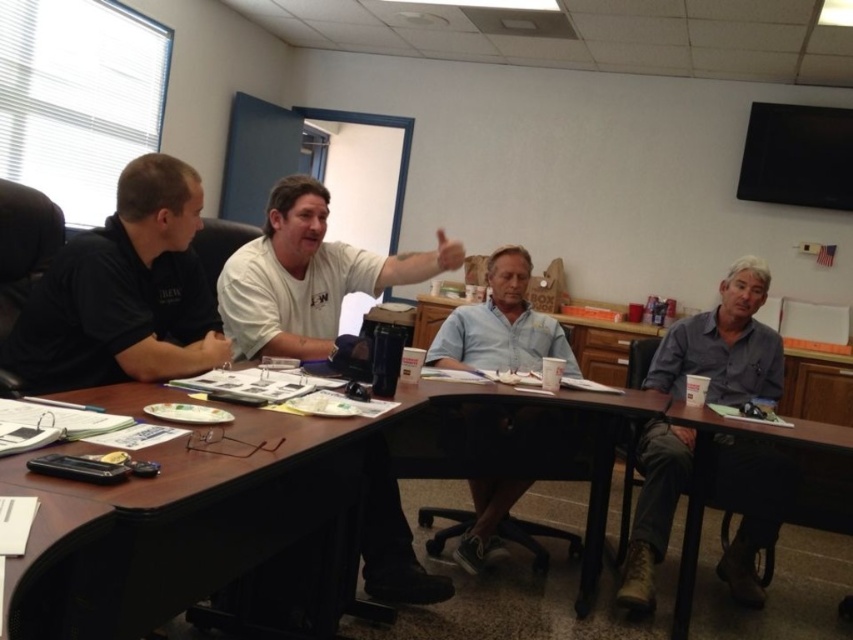
You are a photographer setting up for a group photo of the men seated around the conference table. You need to adjust the camera height to ensure both the black shirt at left and the gray fabric shirt at right are framed properly. Which shirt should you focus on to set the correct height for the camera?

The gray fabric shirt at right is taller than the black shirt at left, so you should focus on the gray fabric shirt at right to set the correct camera height for proper framing.

Based on the photo, you are organizing a meeting and need to place a 2 meter long banner on the table. The banner must be placed between the brown wood table at center and the gray fabric shirt at right. Is there enough space between them to place the banner?

The brown wood table at center is positioned on the left side of gray fabric shirt at right, but the distance between them is not specified. Therefore, it is unclear if there is enough space to place the 2 meter long banner between them.